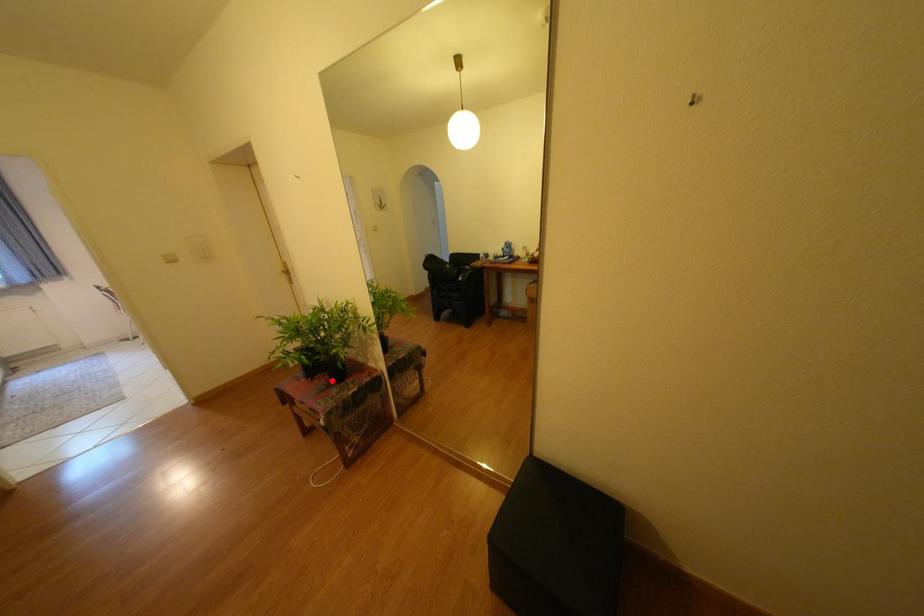
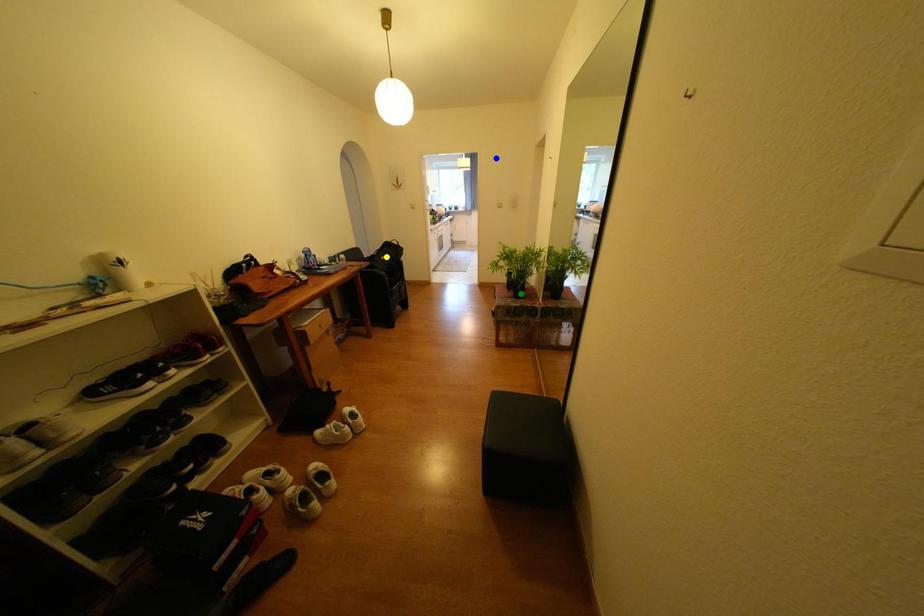
Question: I am providing you with two images of the same scene from different viewpoints. A red point is marked on the first image. You are given multiple points on the second image. Which point in image 2 is actually the same real-world point as the red point in image 1?

Choices:
 (A) yellow point
 (B) green point
 (C) blue point

Answer: (B)